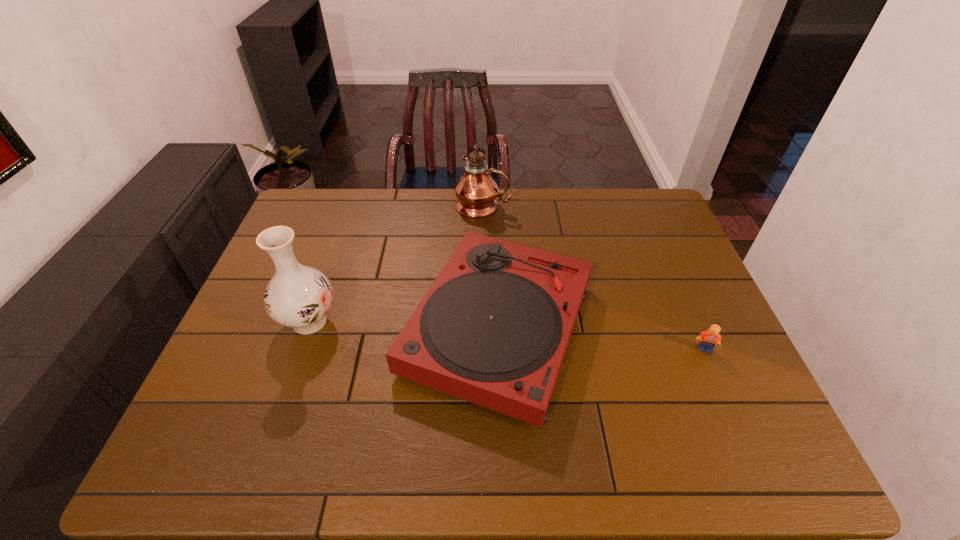
This screenshot has width=960, height=540. In the image, there is a desktop. Find the location of `vacant space at the far right corner`. vacant space at the far right corner is located at coordinates (617, 210).

In order to click on free space between the rightmost object and the tallest object in this screenshot , I will do `click(593, 277)`.

Find the location of a particular element. unoccupied position between the oil lamp and the Lego is located at coordinates (593, 277).

You are a GUI agent. You are given a task and a screenshot of the screen. Output one action in this format:
    pyautogui.click(x=<x>, y=<y>)
    Task: Click on the free space between the record player and the shortest object
    
    Given the screenshot: What is the action you would take?
    pyautogui.click(x=601, y=339)

You are a GUI agent. You are given a task and a screenshot of the screen. Output one action in this format:
    pyautogui.click(x=<x>, y=<y>)
    Task: Click on the unoccupied area between the third tallest object and the rightmost object
    This screenshot has width=960, height=540.
    Given the screenshot: What is the action you would take?
    click(601, 339)

The image size is (960, 540). In order to click on vacant space that is in between the record player and the vase in this screenshot , I will do `click(404, 325)`.

The width and height of the screenshot is (960, 540). Identify the location of vacant region between the farthest object and the vase. (396, 264).

This screenshot has width=960, height=540. Find the location of `vacant space that's between the Lego and the tallest object`. vacant space that's between the Lego and the tallest object is located at coordinates (593, 277).

You are a GUI agent. You are given a task and a screenshot of the screen. Output one action in this format:
    pyautogui.click(x=<x>, y=<y>)
    Task: Click on the object that is the third closest to the third shortest object
    
    Given the screenshot: What is the action you would take?
    pyautogui.click(x=711, y=337)

This screenshot has width=960, height=540. I want to click on the closest object relative to the third shortest object, so click(493, 328).